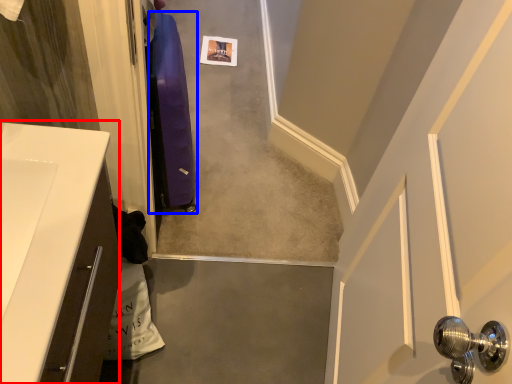
Question: Which of the following is the closest to the observer, counter top (highlighted by a red box) or luggage (highlighted by a blue box)?

Choices:
 (A) counter top
 (B) luggage

Answer: (A)